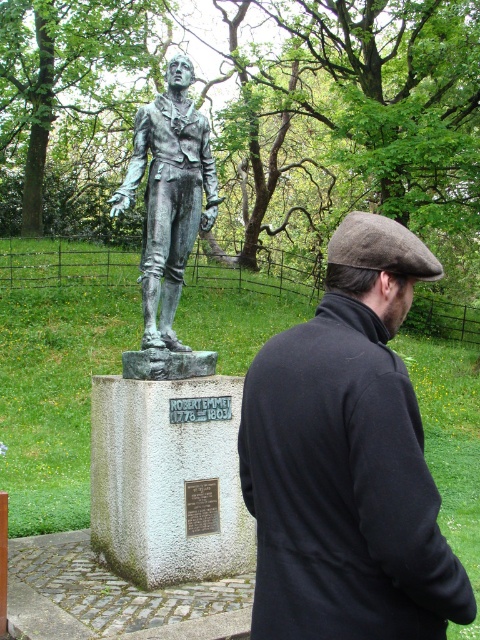
Is dark brown woolen cap at center behind bronze statue at center?

No, dark brown woolen cap at center is closer to the viewer.

Is point (382, 248) farther from viewer compared to point (143, 168)?

No, it is in front of (143, 168).

Does point (324, 397) lie behind point (184, 124)?

That is False.

This screenshot has width=480, height=640. I want to click on dark brown woolen cap at center, so click(347, 460).